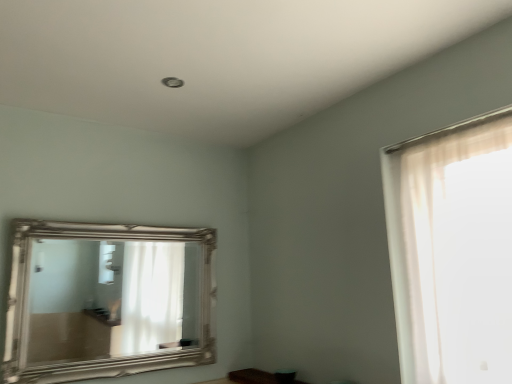
Find the location of a particular element. The height and width of the screenshot is (384, 512). silver/golden metallic mirror at left is located at coordinates (110, 299).

What is the approximate height of silver/golden metallic mirror at left?

silver/golden metallic mirror at left is 66.93 centimeters in height.

What do you see at coordinates (110, 299) in the screenshot?
I see `silver/golden metallic mirror at left` at bounding box center [110, 299].

Locate an element on the screen. This screenshot has width=512, height=384. silver/golden metallic mirror at left is located at coordinates (110, 299).